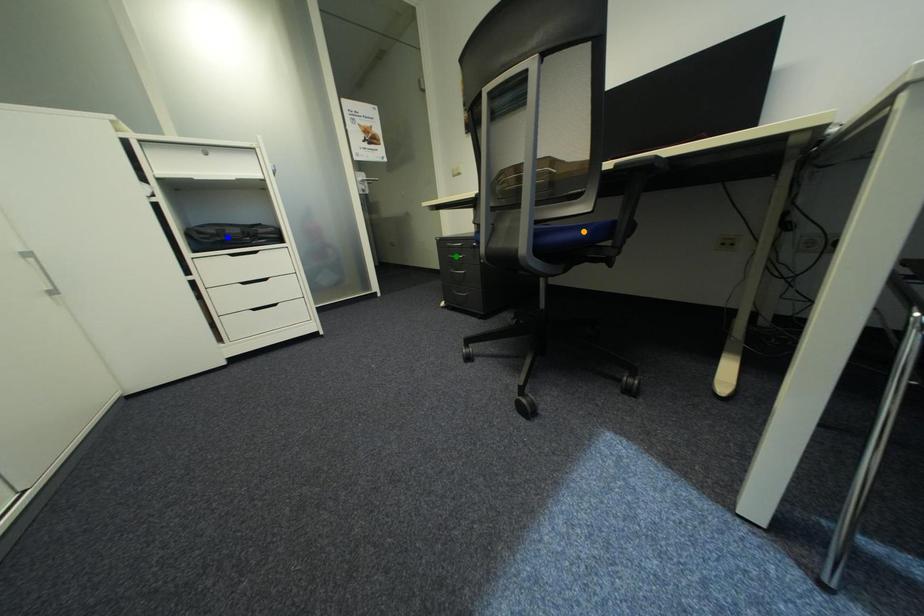
Order these from nearest to farthest:
1. orange point
2. green point
3. blue point

green point, blue point, orange point